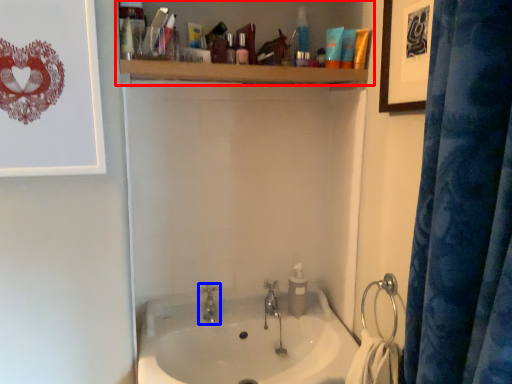
Question: Which point is closer to the camera, bathroom cabinet (highlighted by a red box) or tap (highlighted by a blue box)?

Choices:
 (A) bathroom cabinet
 (B) tap

Answer: (A)